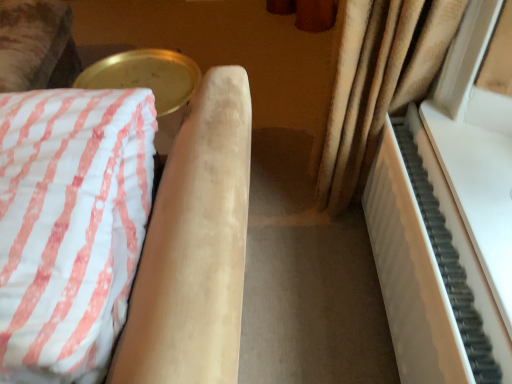
Where is `free spot behind white matte piano at right`? free spot behind white matte piano at right is located at coordinates (313, 212).